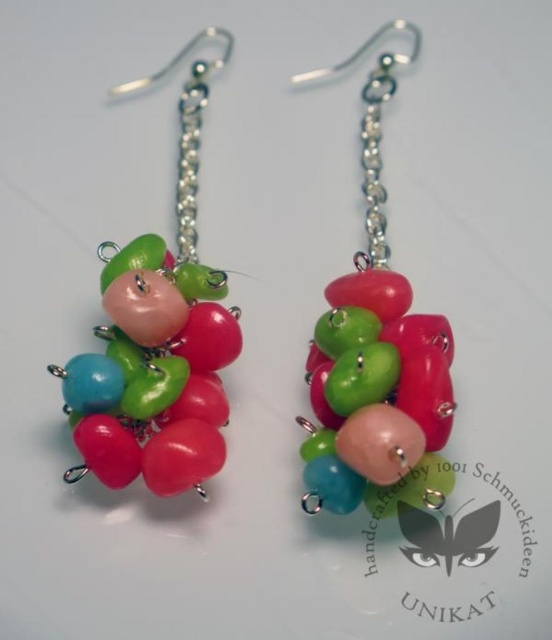
Question: Which object appears farthest from the camera in this image?

Choices:
 (A) matte plastic beads at center
 (B) matte plastic beads at left

Answer: (B)

Question: Can you confirm if matte plastic beads at left is thinner than matte plastic beads at center?

Choices:
 (A) yes
 (B) no

Answer: (B)

Question: Does matte plastic beads at left have a larger size compared to matte plastic beads at center?

Choices:
 (A) no
 (B) yes

Answer: (A)

Question: Among these objects, which one is farthest from the camera?

Choices:
 (A) matte plastic beads at left
 (B) matte plastic beads at center

Answer: (A)

Question: Is matte plastic beads at left below matte plastic beads at center?

Choices:
 (A) yes
 (B) no

Answer: (B)